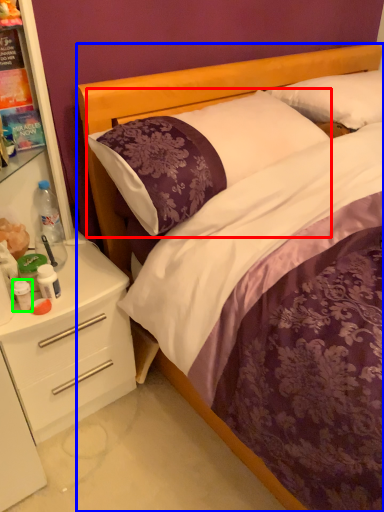
Question: Based on their relative distances, which object is nearer to pillow (highlighted by a red box)? Choose from bed (highlighted by a blue box) and bottle (highlighted by a green box).

Choices:
 (A) bed
 (B) bottle

Answer: (A)